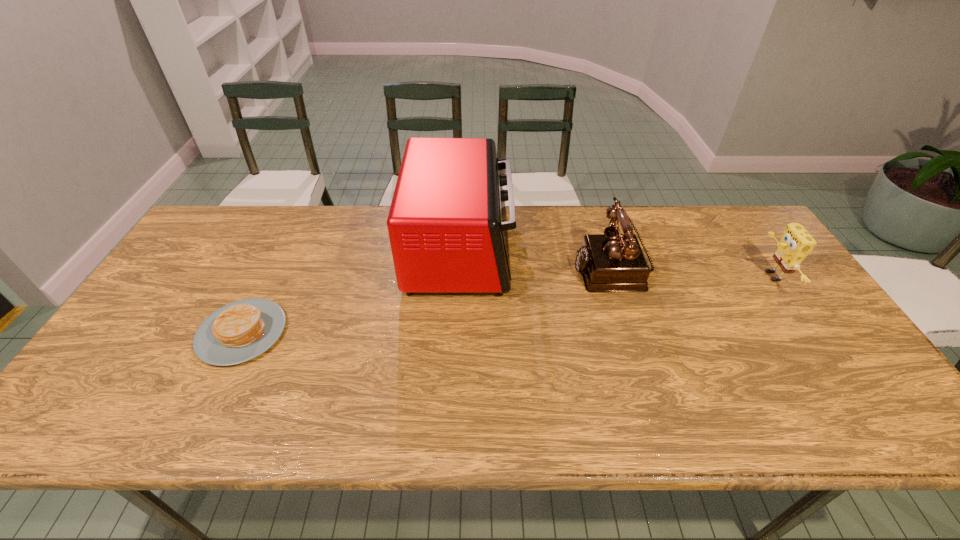
Locate an element on the screen. The height and width of the screenshot is (540, 960). unoccupied area between the leftmost object and the sponge is located at coordinates (507, 305).

Where is `unoccupied area between the leftmost object and the toaster oven`? This screenshot has width=960, height=540. unoccupied area between the leftmost object and the toaster oven is located at coordinates (351, 291).

The image size is (960, 540). In order to click on vacant area between the third object from left to right and the pancake in this screenshot , I will do point(427,300).

Locate which object is the third closest to the leftmost object. Please provide its 2D coordinates. Your answer should be formatted as a tuple, i.e. [(x, y)], where the tuple contains the x and y coordinates of a point satisfying the conditions above.

[(796, 243)]

This screenshot has width=960, height=540. I want to click on object that stands as the second closest to the leftmost object, so click(611, 262).

In order to click on vacant area in the image that satisfies the following two spatial constraints: 1. on the front-facing side of the tallest object; 2. on the front side of the pancake in this screenshot , I will do `click(457, 333)`.